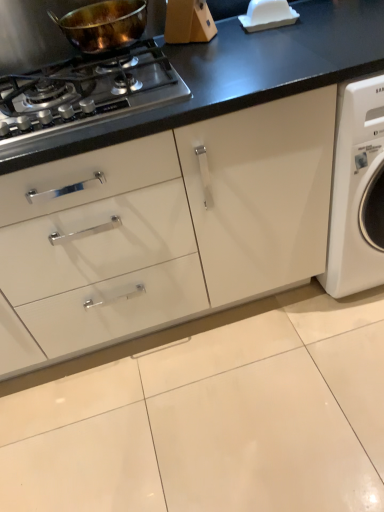
Image resolution: width=384 pixels, height=512 pixels. Identify the location of shiny metallic gas stove at upper left. coord(86,92).

Describe the element at coordinates (86, 92) in the screenshot. This screenshot has width=384, height=512. I see `shiny metallic gas stove at upper left` at that location.

In order to face shiny copper pan at upper left, should I rotate leftwards or rightwards?

To face it directly, rotate left by 11.838 degrees.

Describe the element at coordinates (103, 25) in the screenshot. I see `shiny copper pan at upper left` at that location.

Where is `shiny copper pan at upper left`? The width and height of the screenshot is (384, 512). shiny copper pan at upper left is located at coordinates (103, 25).

This screenshot has height=512, width=384. I want to click on shiny metallic gas stove at upper left, so 86,92.

Which object is positioned more to the right, shiny copper pan at upper left or shiny metallic gas stove at upper left?

From the viewer's perspective, shiny copper pan at upper left appears more on the right side.

Relative to shiny metallic gas stove at upper left, is shiny copper pan at upper left in front or behind?

shiny copper pan at upper left is behind shiny metallic gas stove at upper left.

Is point (104, 39) in front of point (9, 100)?

No, (104, 39) is further to viewer.

From the image's perspective, is shiny copper pan at upper left above or below shiny metallic gas stove at upper left?

Clearly, from the image's perspective, shiny copper pan at upper left is above shiny metallic gas stove at upper left.

From a real-world perspective, is shiny copper pan at upper left physically located above or below shiny metallic gas stove at upper left?

From a real-world perspective, shiny copper pan at upper left is physically above shiny metallic gas stove at upper left.

Is shiny copper pan at upper left wider than shiny metallic gas stove at upper left?

In fact, shiny copper pan at upper left might be narrower than shiny metallic gas stove at upper left.

Does shiny copper pan at upper left have a greater height compared to shiny metallic gas stove at upper left?

Indeed, shiny copper pan at upper left has a greater height compared to shiny metallic gas stove at upper left.

Is shiny copper pan at upper left smaller than shiny metallic gas stove at upper left?

Yes, shiny copper pan at upper left is smaller than shiny metallic gas stove at upper left.

Is shiny copper pan at upper left inside the boundaries of shiny metallic gas stove at upper left, or outside?

The correct answer is: outside.

Are shiny copper pan at upper left and shiny metallic gas stove at upper left located far from each other?

No, there isn't a large distance between shiny copper pan at upper left and shiny metallic gas stove at upper left.

Is shiny copper pan at upper left oriented towards shiny metallic gas stove at upper left?

No.

What's the angular difference between shiny copper pan at upper left and shiny metallic gas stove at upper left's facing directions?

0.00374 degrees.

Find the location of a particular element. kitchen appliance positioned vertically above the shiny metallic gas stove at upper left (from a real-world perspective) is located at coordinates (103, 25).

Can you confirm if shiny metallic gas stove at upper left is positioned to the left of shiny copper pan at upper left?

Correct, you'll find shiny metallic gas stove at upper left to the left of shiny copper pan at upper left.

Which object is further away from the camera taking this photo, shiny metallic gas stove at upper left or shiny copper pan at upper left?

shiny copper pan at upper left.

Which is closer, (79, 87) or (99, 49)?

Positioned in front is point (79, 87).

From the image's perspective, between shiny metallic gas stove at upper left and shiny copper pan at upper left, which one is located above?

shiny copper pan at upper left.

From a real-world perspective, between shiny metallic gas stove at upper left and shiny copper pan at upper left, who is vertically lower?

In real-world perspective, shiny metallic gas stove at upper left is lower.

Based on the photo, which of these two, shiny metallic gas stove at upper left or shiny copper pan at upper left, is wider?

Wider between the two is shiny metallic gas stove at upper left.

Which of these two, shiny metallic gas stove at upper left or shiny copper pan at upper left, stands shorter?

shiny metallic gas stove at upper left is shorter.

Who is smaller, shiny metallic gas stove at upper left or shiny copper pan at upper left?

Smaller between the two is shiny copper pan at upper left.

Would you say shiny metallic gas stove at upper left is outside shiny copper pan at upper left?

Yes.

Are shiny metallic gas stove at upper left and shiny copper pan at upper left located far from each other?

No, shiny metallic gas stove at upper left is not far from shiny copper pan at upper left.

Is shiny metallic gas stove at upper left oriented towards shiny copper pan at upper left?

No, shiny metallic gas stove at upper left does not turn towards shiny copper pan at upper left.

The image size is (384, 512). Find the location of `kitchen appliance above the shiny metallic gas stove at upper left (from the image's perspective)`. kitchen appliance above the shiny metallic gas stove at upper left (from the image's perspective) is located at coordinates (103, 25).

Find the location of `kitchen appliance to the right of shiny metallic gas stove at upper left`. kitchen appliance to the right of shiny metallic gas stove at upper left is located at coordinates (103, 25).

You are a GUI agent. You are given a task and a screenshot of the screen. Output one action in this format:
    pyautogui.click(x=<x>, y=<y>)
    Task: Click on the kitchen appliance behind the shiny metallic gas stove at upper left
    
    Given the screenshot: What is the action you would take?
    pyautogui.click(x=103, y=25)